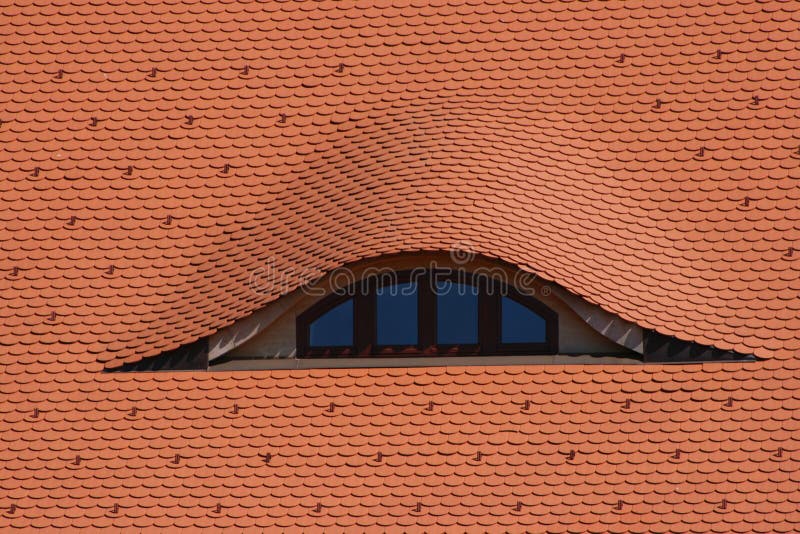
Locate an element on the screen. This screenshot has height=534, width=800. glass is located at coordinates (528, 328), (454, 323), (385, 321), (333, 329).